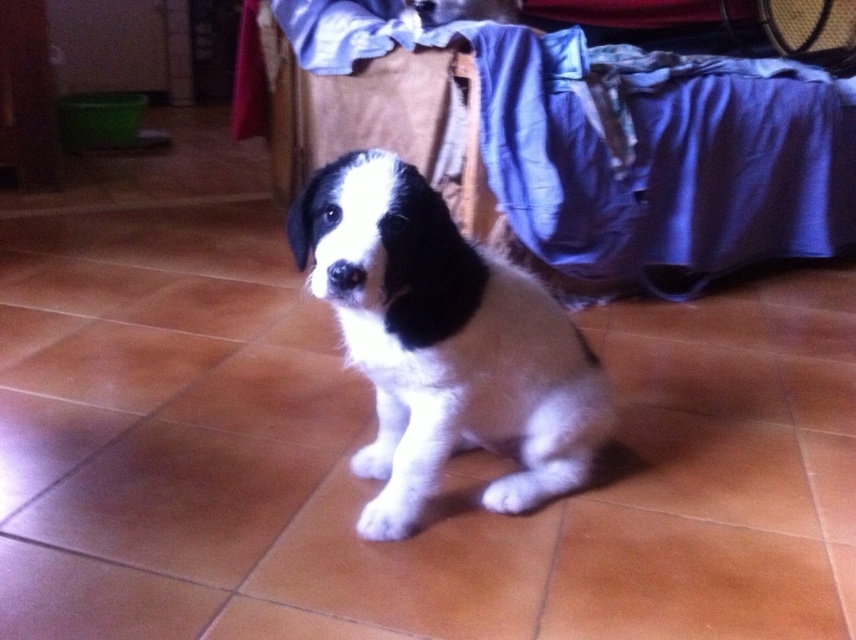
Which is below, white fur dog at center or white fluffy paw at center?

white fluffy paw at center

Can you confirm if white fur dog at center is positioned below white fluffy paw at center?

Actually, white fur dog at center is above white fluffy paw at center.

This screenshot has height=640, width=856. In order to click on white fur dog at center in this screenshot , I will do `click(447, 333)`.

At what (x,y) coordinates should I click in order to perform the action: click on white fur dog at center. Please return your answer as a coordinate pair (x, y). The image size is (856, 640). Looking at the image, I should click on (447, 333).

Can you confirm if white fluffy paw at center is bigger than white fur paw at center?

Actually, white fluffy paw at center might be smaller than white fur paw at center.

From the picture: Does white fluffy paw at center appear on the right side of white fur paw at center?

Yes, white fluffy paw at center is to the right of white fur paw at center.

Find the location of a particular element. The image size is (856, 640). white fluffy paw at center is located at coordinates (389, 515).

Identify the location of white fluffy paw at center. The image size is (856, 640). (389, 515).

What do you see at coordinates (447, 333) in the screenshot? I see `white fur dog at center` at bounding box center [447, 333].

Where is `white fur dog at center`? white fur dog at center is located at coordinates (447, 333).

Identify the location of white fur dog at center. (447, 333).